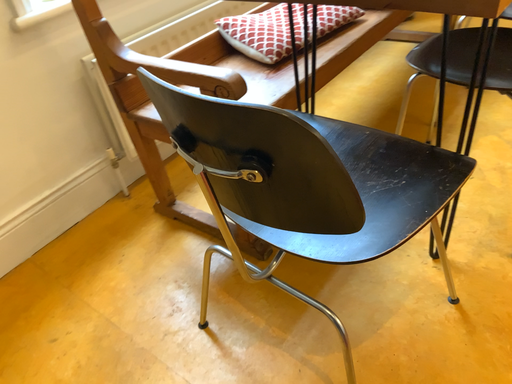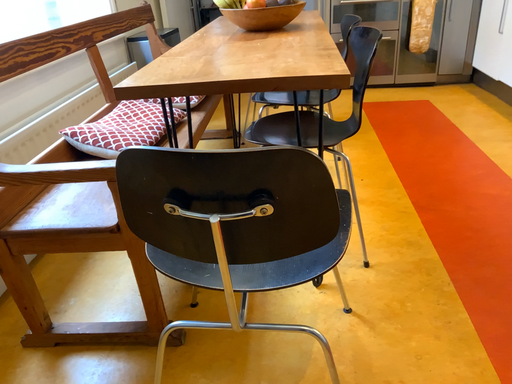
Question: Which way did the camera rotate in the video?

Choices:
 (A) rotated left
 (B) rotated right

Answer: (B)